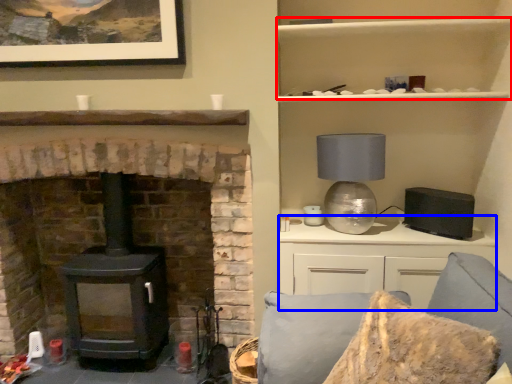
Question: Which of the following is the farthest to the observer, cabinet (highlighted by a red box) or entertainment center (highlighted by a blue box)?

Choices:
 (A) cabinet
 (B) entertainment center

Answer: (B)